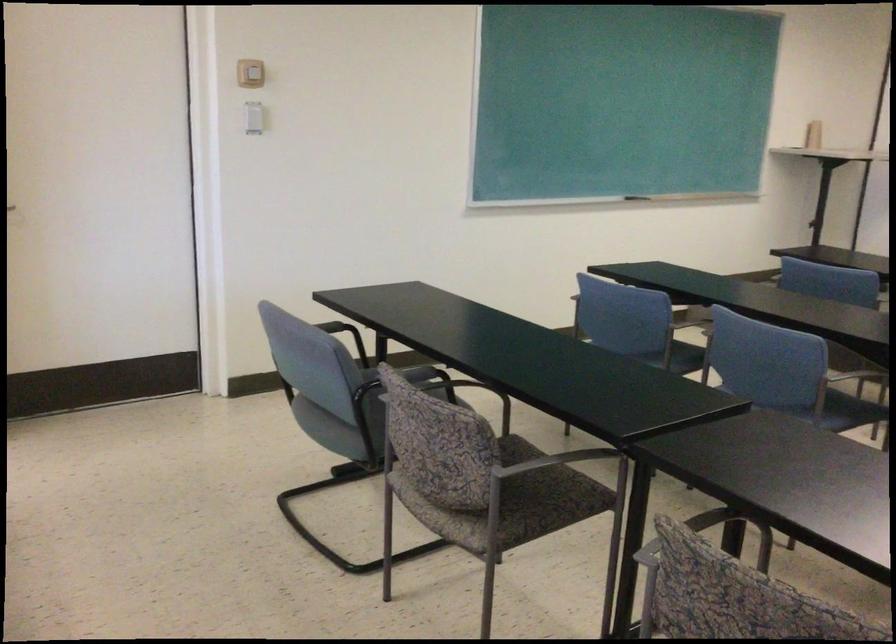
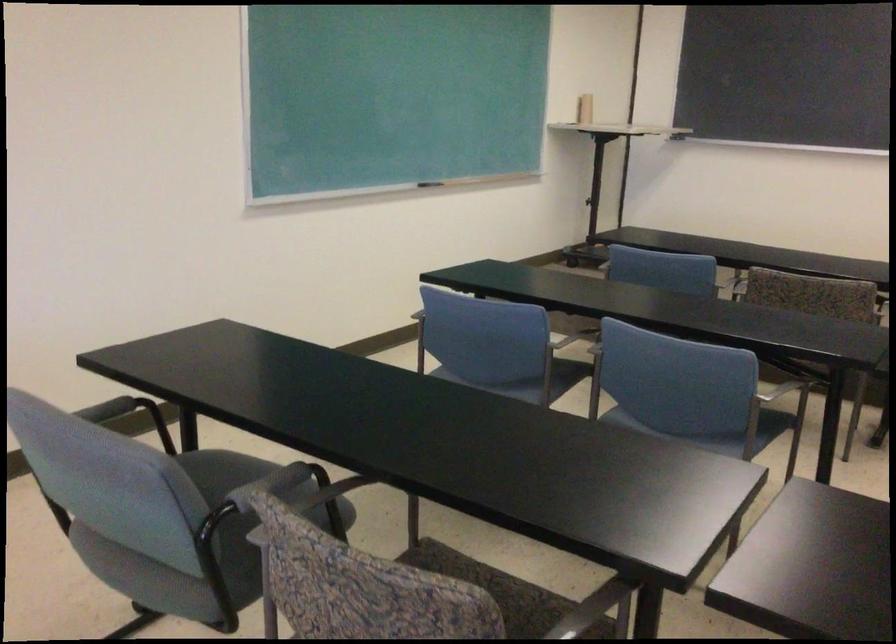
The first image is from the beginning of the video and the second image is from the end. How did the camera likely rotate when shooting the video?

The rotation direction of the camera is right-down.